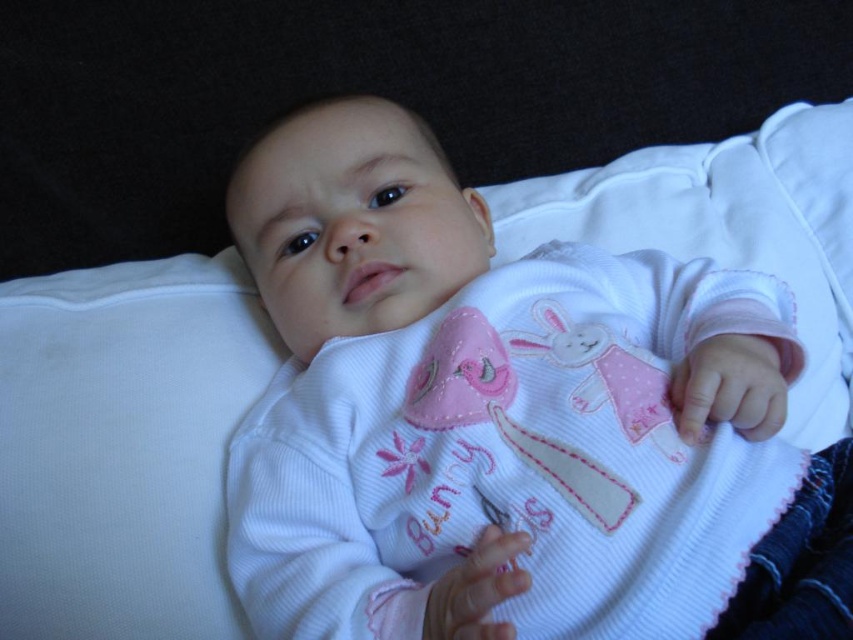
Question: Where is white corduroy onesie at center located in relation to white soft pillow at upper left in the image?

Choices:
 (A) left
 (B) right

Answer: (B)

Question: Which point appears farthest from the camera in this image?

Choices:
 (A) (91, 616)
 (B) (331, 412)

Answer: (A)

Question: Which point is farther from the camera taking this photo?

Choices:
 (A) (178, 502)
 (B) (734, 556)

Answer: (A)

Question: Observing the image, what is the correct spatial positioning of white corduroy onesie at center in reference to white soft pillow at upper left?

Choices:
 (A) left
 (B) right

Answer: (B)

Question: Which object is farther from the camera taking this photo?

Choices:
 (A) white corduroy onesie at center
 (B) white soft pillow at upper left

Answer: (B)

Question: Does white corduroy onesie at center appear under white soft pillow at upper left?

Choices:
 (A) yes
 (B) no

Answer: (B)